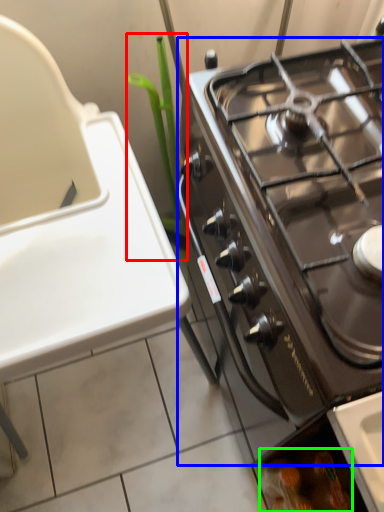
Question: Estimate the real-world distances between objects in this image. Which object is farther from plant (highlighted by a red box), gas stove (highlighted by a blue box) or food (highlighted by a green box)?

Choices:
 (A) gas stove
 (B) food

Answer: (B)